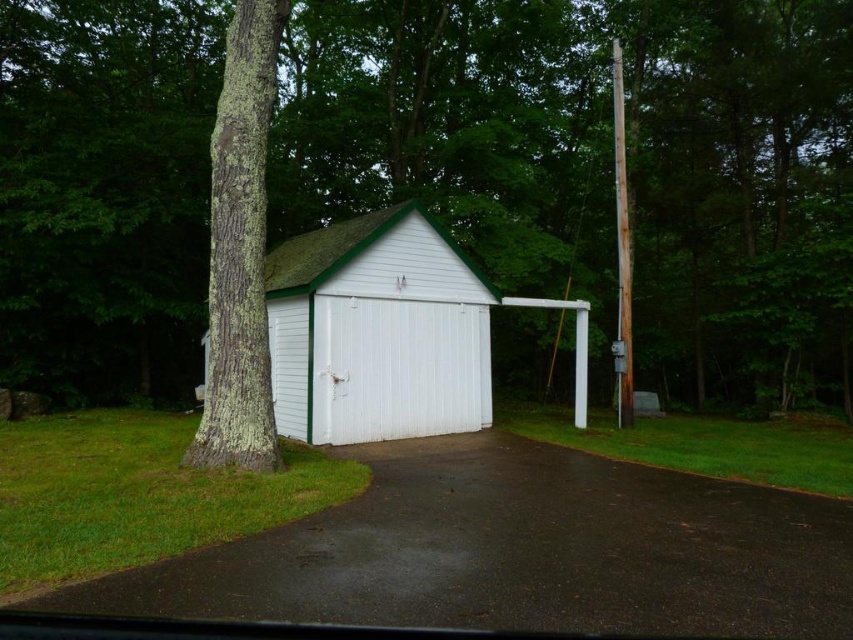
Based on the photo, you are standing in the grassy area near the white woodshed at center and want to walk to the rusty wood pole at right. Which direction should you move relative to the shed?

You should move to the right of the white woodshed at center to reach the rusty wood pole at right since the shed is to the left of the pole.

You are a painter who needs to move a ladder from the rusty wood pole at right to the white woodshed at center. Since the ladder is 1.5 meters wide, will it fit between them without touching either structure?

The white woodshed at center is thinner than the rusty wood pole at right, but the exact distance between them isn